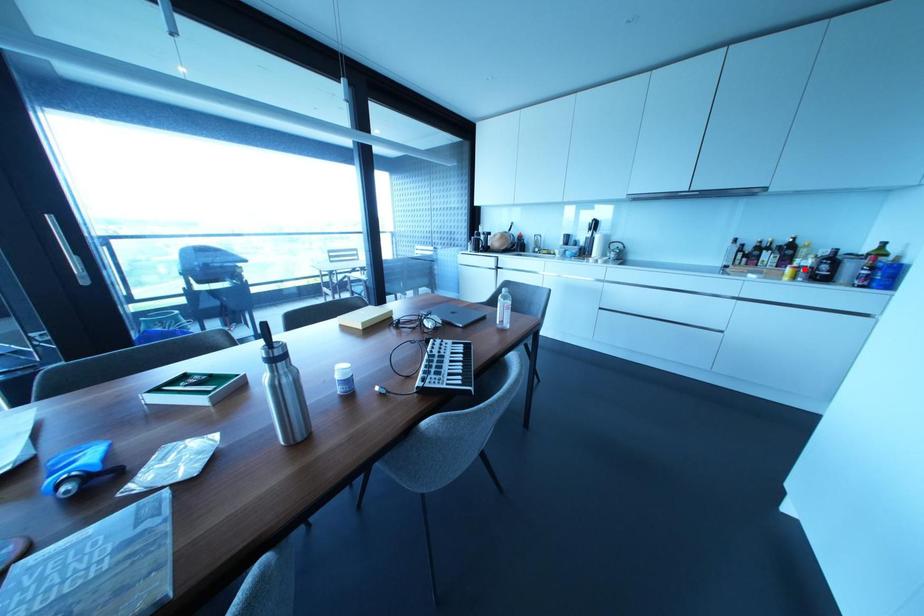
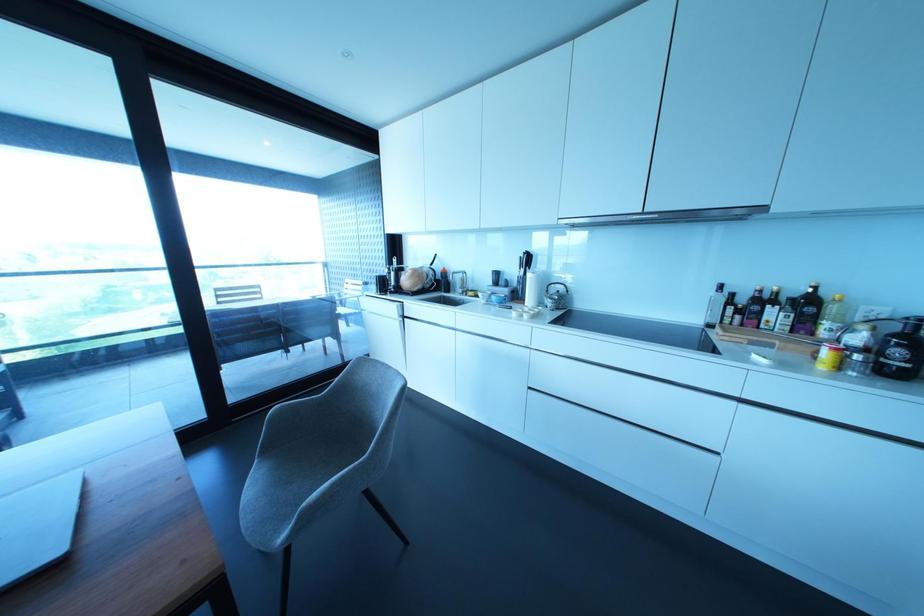
Question: I am providing you with two images of the same scene from different viewpoints. A red point is marked on the first image. Can you still see the location of the red point in image 2?

Choices:
 (A) Yes
 (B) No

Answer: (A)